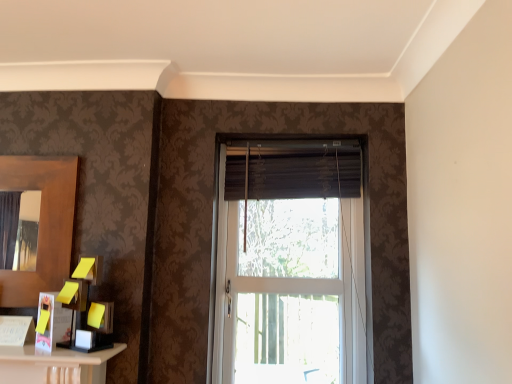
Question: Does brown wooden mirror at left have a lesser height compared to dark brown fabric curtain at center?

Choices:
 (A) no
 (B) yes

Answer: (A)

Question: Is brown wooden mirror at left at the left side of dark brown fabric curtain at center?

Choices:
 (A) yes
 (B) no

Answer: (A)

Question: From the image's perspective, would you say brown wooden mirror at left is positioned over dark brown fabric curtain at center?

Choices:
 (A) no
 (B) yes

Answer: (A)

Question: Can dark brown fabric curtain at center be found inside brown wooden mirror at left?

Choices:
 (A) no
 (B) yes

Answer: (A)

Question: Considering the relative sizes of brown wooden mirror at left and dark brown fabric curtain at center in the image provided, is brown wooden mirror at left bigger than dark brown fabric curtain at center?

Choices:
 (A) yes
 (B) no

Answer: (B)

Question: From the image's perspective, is brown wooden mirror at left located above or below white glass window at center?

Choices:
 (A) above
 (B) below

Answer: (A)

Question: Considering the positions of point (55, 175) and point (259, 205), is point (55, 175) closer or farther from the camera than point (259, 205)?

Choices:
 (A) closer
 (B) farther

Answer: (A)

Question: Based on their sizes in the image, would you say brown wooden mirror at left is bigger or smaller than white glass window at center?

Choices:
 (A) big
 (B) small

Answer: (B)

Question: Is brown wooden mirror at left situated inside white glass window at center or outside?

Choices:
 (A) outside
 (B) inside

Answer: (A)

Question: From the image's perspective, is white glass window at center located above or below dark brown fabric curtain at center?

Choices:
 (A) above
 (B) below

Answer: (B)

Question: Is white glass window at center in front of or behind dark brown fabric curtain at center in the image?

Choices:
 (A) behind
 (B) front

Answer: (B)

Question: Which is correct: white glass window at center is inside dark brown fabric curtain at center, or outside of it?

Choices:
 (A) inside
 (B) outside

Answer: (B)

Question: Is white glass window at center to the left or to the right of dark brown fabric curtain at center in the image?

Choices:
 (A) right
 (B) left

Answer: (A)

Question: From their relative heights in the image, would you say dark brown fabric curtain at center is taller or shorter than white glass window at center?

Choices:
 (A) tall
 (B) short

Answer: (B)

Question: Relative to white glass window at center, is dark brown fabric curtain at center in front or behind?

Choices:
 (A) behind
 (B) front

Answer: (A)